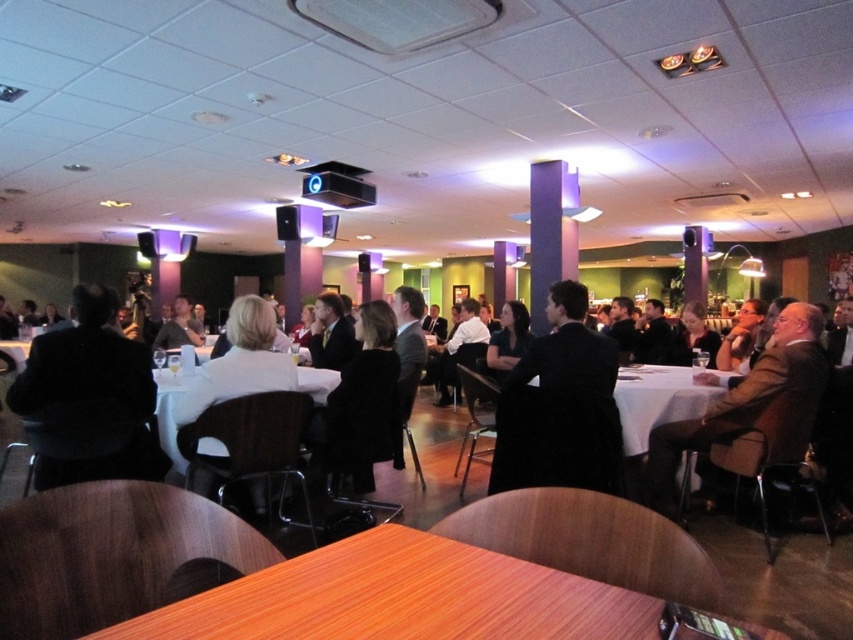
Based on the photo, is black suit at center below dark suit at center?

Indeed, black suit at center is positioned under dark suit at center.

I want to click on black suit at center, so click(x=560, y=406).

Find the location of a particular element. black suit at center is located at coordinates (560, 406).

Is wooden table at center shorter than black suit at center?

Yes.

Which of these two, wooden table at center or black suit at center, stands shorter?

With less height is wooden table at center.

Does point (228, 605) lie behind point (491, 486)?

No.

Find the location of `wooden table at center`. wooden table at center is located at coordinates (402, 596).

Can you confirm if white glossy table at center is smaller than dark suit at center?

No, white glossy table at center is not smaller than dark suit at center.

Is white glossy table at center bigger than dark suit at center?

Yes.

Is point (627, 422) farther from viewer compared to point (323, 348)?

No.

The image size is (853, 640). Identify the location of white glossy table at center. (657, 401).